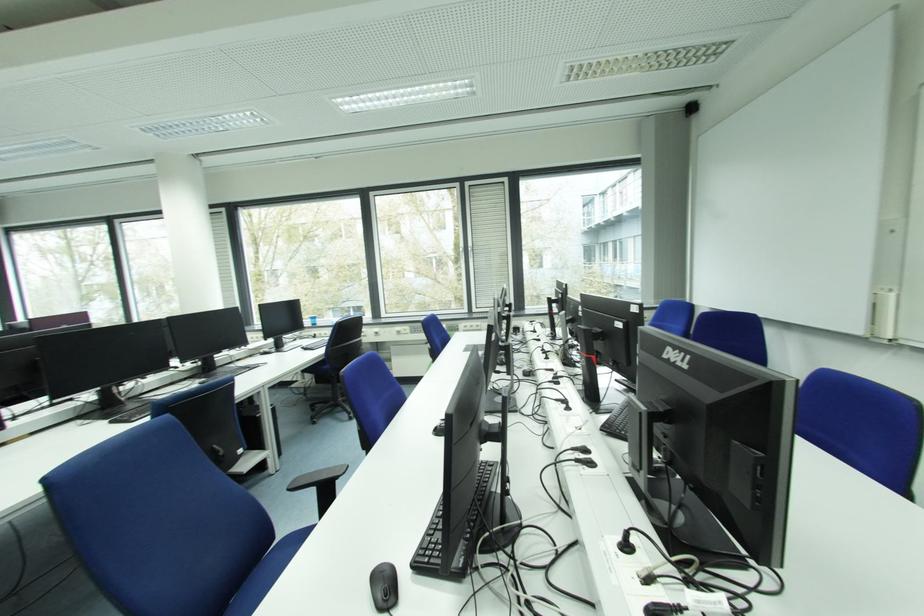
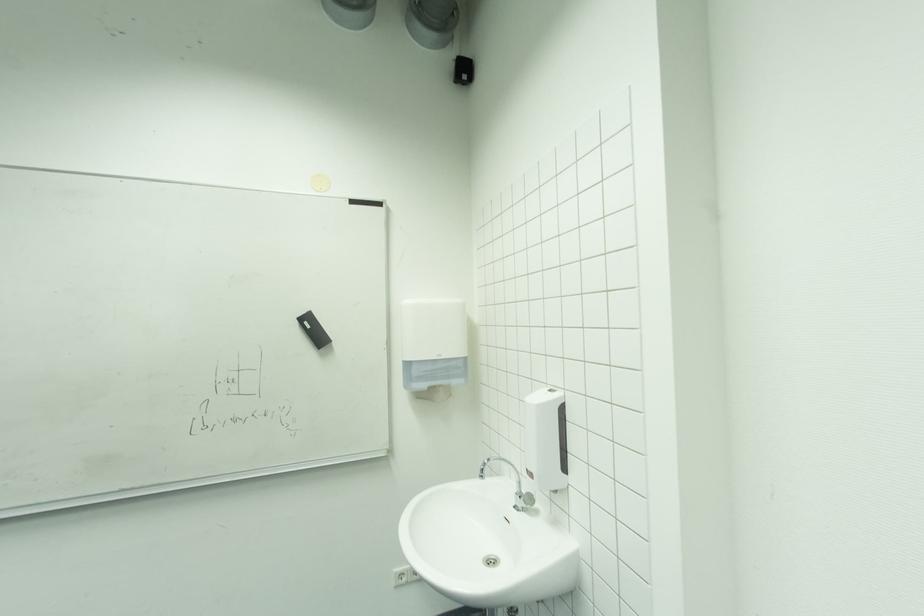
Question: The camera is either moving clockwise (left) or counter-clockwise (right) around the object. The first image is from the beginning of the video and the second image is from the end. Is the camera moving left or right when shooting the video?

Choices:
 (A) Left
 (B) Right

Answer: (A)